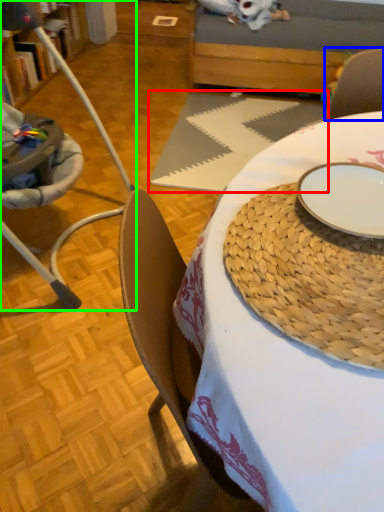
Question: Estimate the real-world distances between objects in this image. Which object is closer to tablecloth (highlighted by a red box), armchair (highlighted by a blue box) or chair (highlighted by a green box)?

Choices:
 (A) armchair
 (B) chair

Answer: (B)